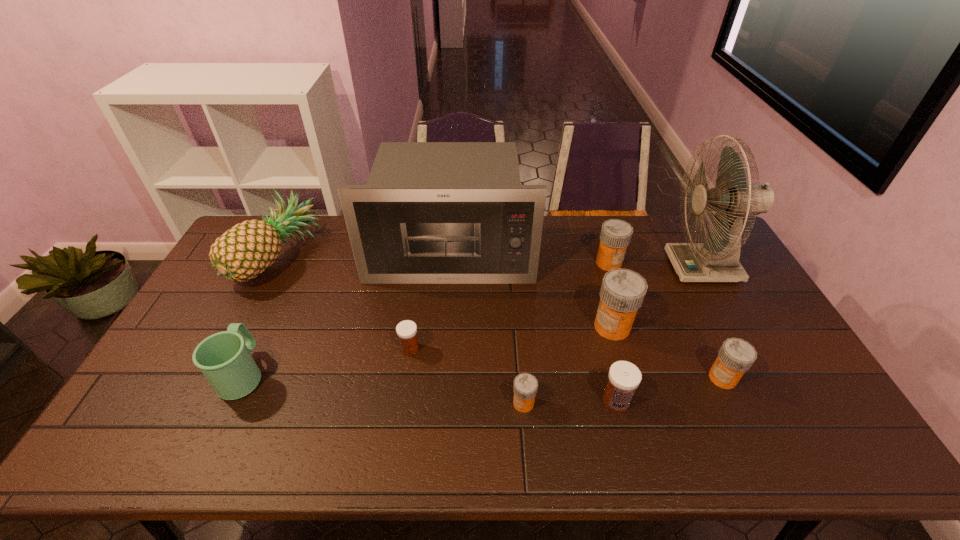
The image size is (960, 540). In order to click on blank space at the far left corner in this screenshot , I will do `click(252, 218)`.

Locate an element on the screen. The image size is (960, 540). vacant area at the near right corner of the desktop is located at coordinates (811, 433).

At what (x,y) coordinates should I click in order to perform the action: click on free area in between the smallest orange medicine and the green mug. Please return your answer as a coordinate pair (x, y). The image size is (960, 540). Looking at the image, I should click on (384, 389).

At what (x,y) coordinates should I click in order to perform the action: click on free space between the gray fan and the second farthest orange medicine. Please return your answer as a coordinate pair (x, y). This screenshot has height=540, width=960. Looking at the image, I should click on (658, 297).

The height and width of the screenshot is (540, 960). Identify the location of blank region between the second biggest orange medicine and the leftmost medicine. (509, 306).

Where is `free space between the third nearest orange medicine and the third biggest orange medicine`? The height and width of the screenshot is (540, 960). free space between the third nearest orange medicine and the third biggest orange medicine is located at coordinates (667, 352).

Locate an element on the screen. The image size is (960, 540). free space between the leftmost medicine and the pineapple is located at coordinates (345, 303).

Image resolution: width=960 pixels, height=540 pixels. What are the coordinates of `empty space between the gray fan and the biggest orange medicine` in the screenshot? It's located at (658, 297).

Identify the location of empty space between the rightmost medicine and the mug. This screenshot has width=960, height=540. (483, 376).

Point out which object is positioned as the fourth nearest to the gray microwave oven. Please provide its 2D coordinates. Your answer should be formatted as a tuple, i.e. [(x, y)], where the tuple contains the x and y coordinates of a point satisfying the conditions above.

[(406, 330)]